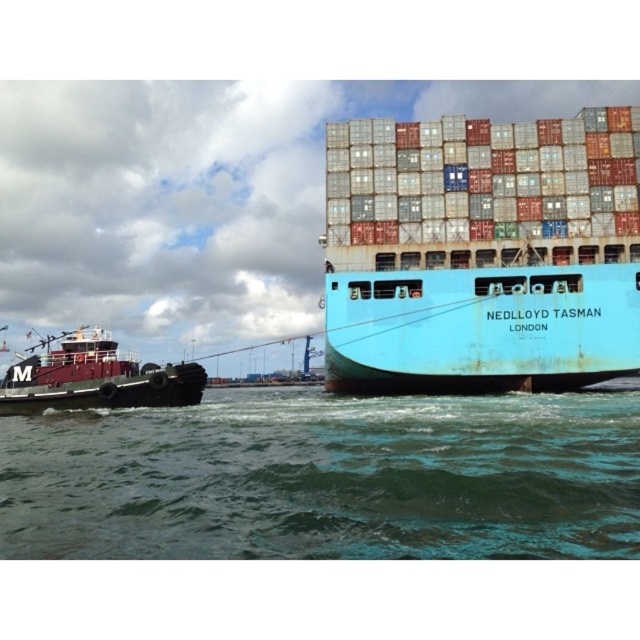
Who is more distant from viewer, (120, 432) or (589, 189)?

Positioned behind is point (589, 189).

Who is more forward, [518,449] or [618,269]?

Positioned in front is point [518,449].

Locate an element on the screen. This screenshot has height=640, width=640. green water at lower center is located at coordinates [326, 477].

Who is positioned more to the right, blue matte container ship at center or maroon rubber tugboat at left?

blue matte container ship at center is more to the right.

Identify the location of blue matte container ship at center. (481, 253).

Is the position of green water at lower center more distant than that of maroon rubber tugboat at left?

No, green water at lower center is in front of maroon rubber tugboat at left.

Between point (147, 436) and point (97, 385), which one is positioned behind?

Point (97, 385)

Locate an element on the screen. The height and width of the screenshot is (640, 640). green water at lower center is located at coordinates (326, 477).